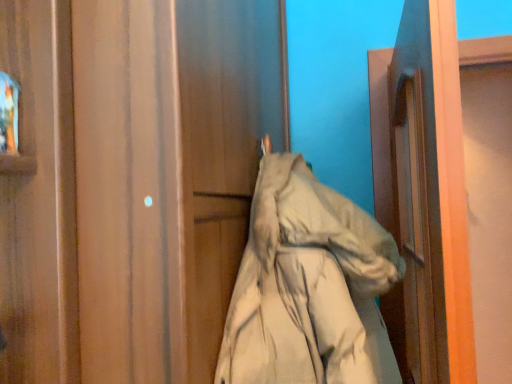
Question: Choose the correct answer: Is matte wood door at center inside printed fabric at upper left or outside it?

Choices:
 (A) inside
 (B) outside

Answer: (B)

Question: Does point (226, 299) appear closer or farther from the camera than point (1, 148)?

Choices:
 (A) farther
 (B) closer

Answer: (A)

Question: Estimate the real-world distances between objects in this image. Which object is farther from the printed fabric at upper left?

Choices:
 (A) beige fabric coat at center
 (B) matte wood door at center

Answer: (A)

Question: Based on their relative distances, which object is farther from the beige fabric coat at center?

Choices:
 (A) printed fabric at upper left
 (B) matte wood door at center

Answer: (A)